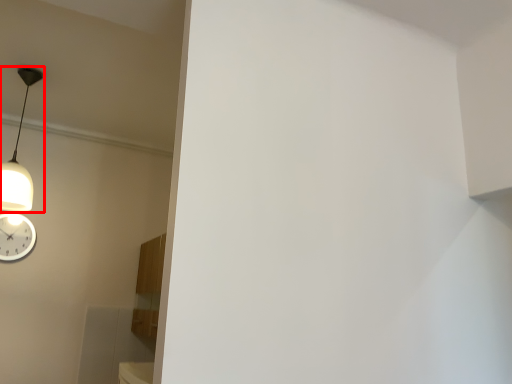
Question: From the image, what is the correct spatial relationship of lamp (annotated by the red box) in relation to wall clock?

Choices:
 (A) left
 (B) right

Answer: (B)